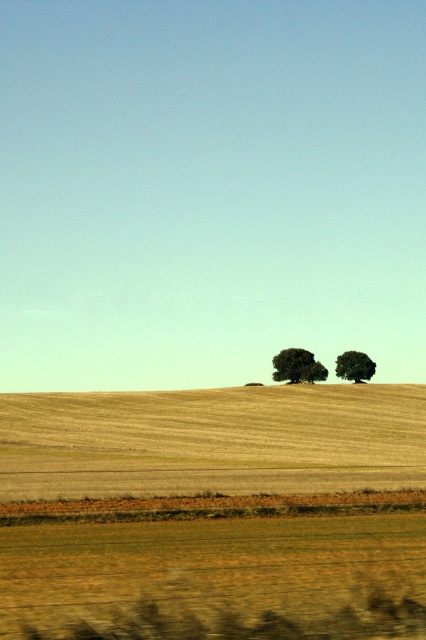
You are standing at the point marked by point (213, 512) in the lower center of the image. Looking around, you see the golden textured wheat field at lower center and the two dark green trees at the horizon. Which direction should you walk to reach the two dark green trees at the horizon?

The two dark green trees at the horizon are located at the upper part of the image, so you should walk upwards from the point (213, 512) marked golden textured wheat field at lower center to reach them.